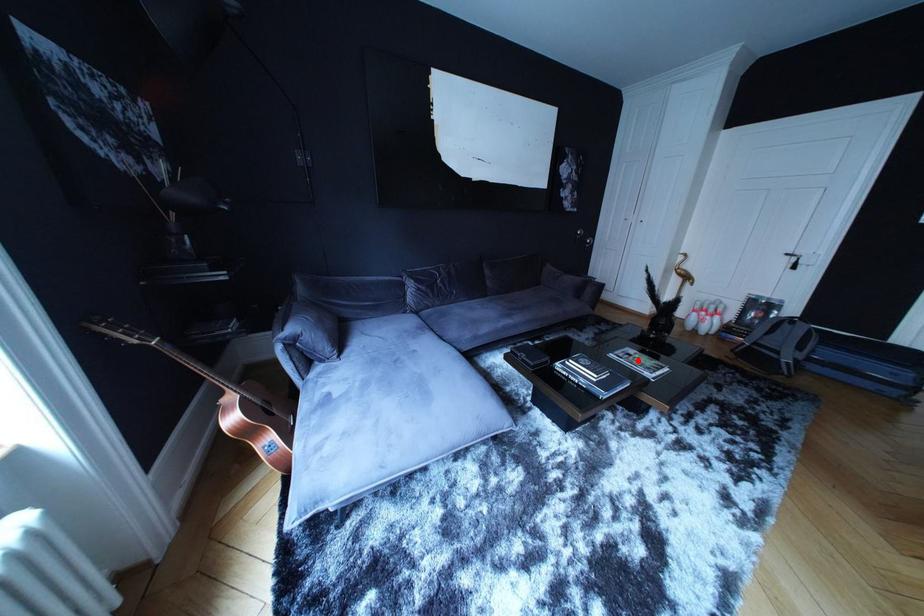
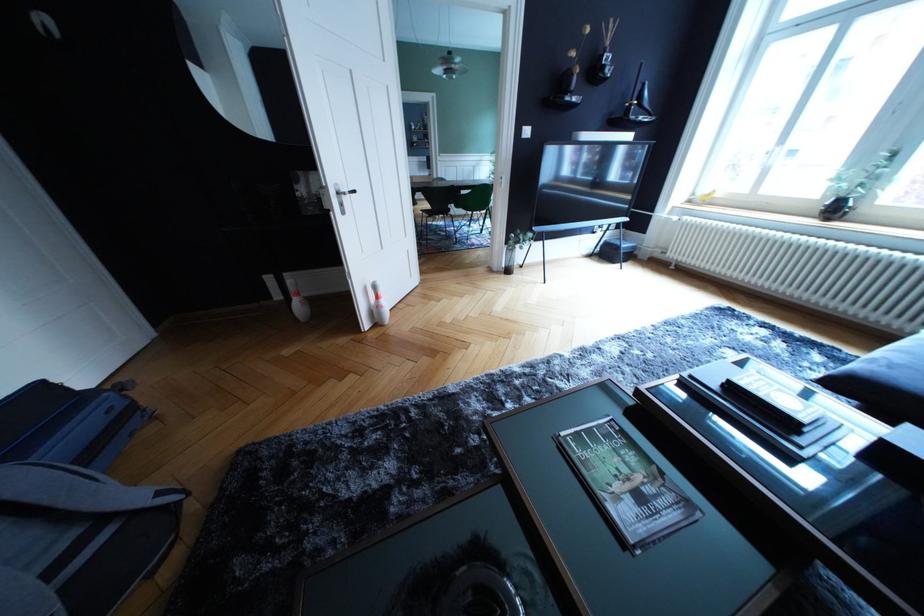
Question: A red point is marked in image1. In image2, is the corresponding 3D point closer to the camera or farther? Reply with the corresponding letter.

Choices:
 (A) The corresponding 3D point is closer.
 (B) The corresponding 3D point is farther.

Answer: (B)